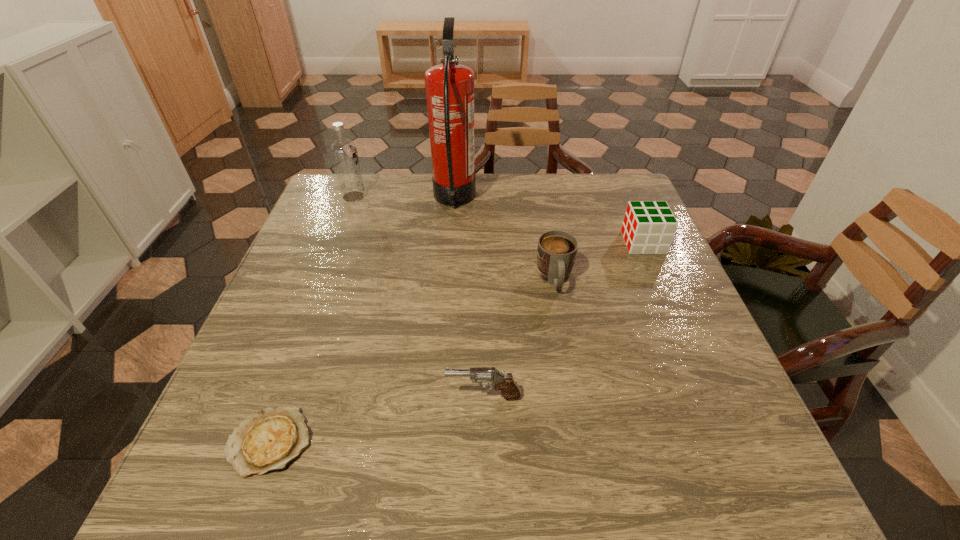
Identify the location of empty location between the nearest object and the tallest object. (362, 321).

At what (x,y) coordinates should I click in order to perform the action: click on free space between the second nearest object and the mug. Please return your answer as a coordinate pair (x, y). Image resolution: width=960 pixels, height=540 pixels. Looking at the image, I should click on (519, 338).

Identify the location of empty space between the cube and the fifth shortest object. (498, 220).

Identify the location of object that ranks as the second closest to the rightmost object. This screenshot has width=960, height=540. pos(449,87).

Find the location of a particular element. The width and height of the screenshot is (960, 540). object that is the second closest to the second tallest object is located at coordinates (556, 252).

Locate an element on the screen. This screenshot has height=540, width=960. vacant area in the image that satisfies the following two spatial constraints: 1. on the side of the third nearest object with the handle; 2. at the barrel of the second nearest object is located at coordinates (575, 396).